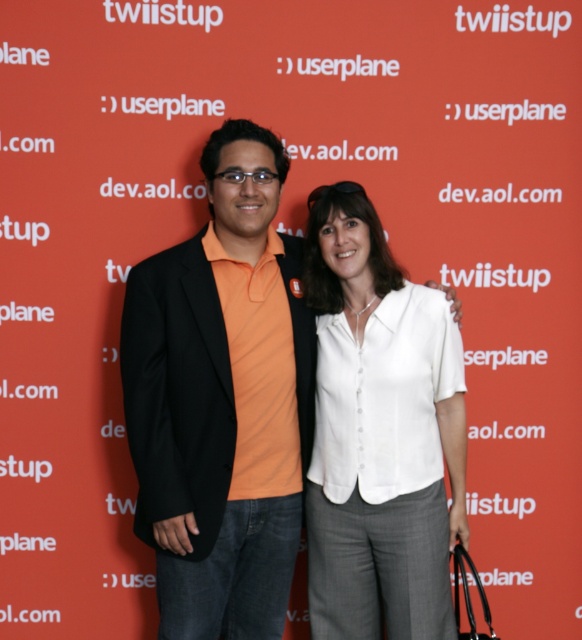
Is orange cotton shirt at center bigger than white cotton blouse at center?

Yes, orange cotton shirt at center is bigger than white cotton blouse at center.

Does point (207, 522) lie behind point (368, 593)?

No, it is in front of (368, 593).

Between point (235, 179) and point (324, 528), which one is positioned behind?

The point (324, 528) is more distant.

This screenshot has height=640, width=582. I want to click on orange cotton shirt at center, so click(222, 401).